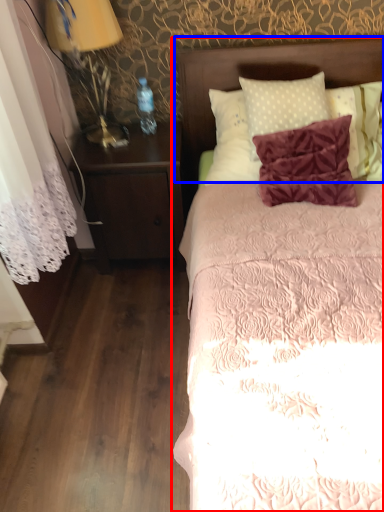
Question: Which point is closer to the camera, bed (highlighted by a red box) or headboard (highlighted by a blue box)?

Choices:
 (A) bed
 (B) headboard

Answer: (A)